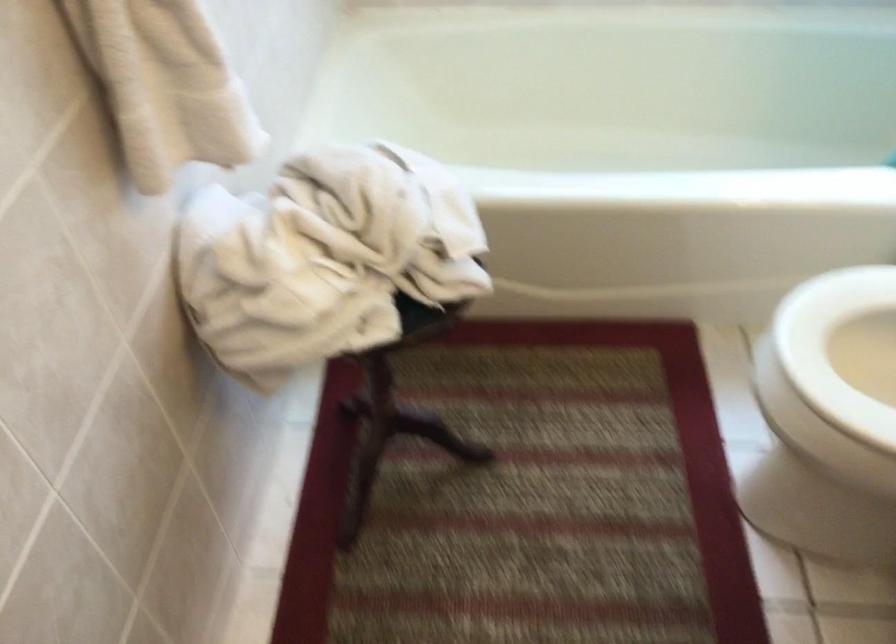
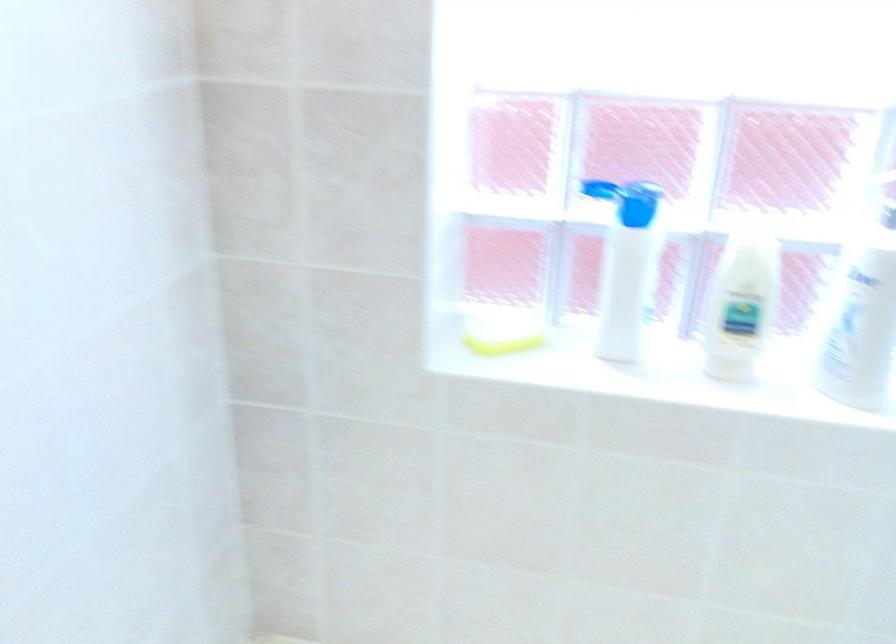
In a continuous first-person perspective shot, in which direction is the camera moving?

The movement direction of the cameraman is right, forward.